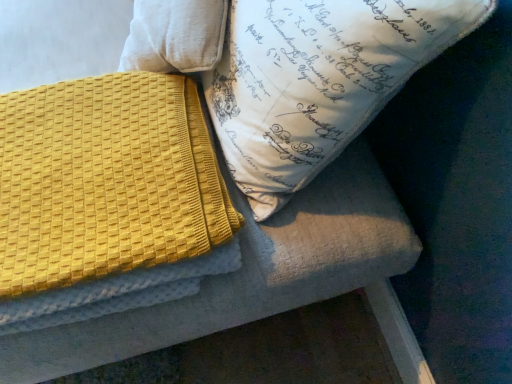
Question: Is white printed pillow at upper center facing towards yellow textured blanket at upper left?

Choices:
 (A) no
 (B) yes

Answer: (B)

Question: Considering the relative sizes of white printed pillow at upper center and yellow textured blanket at upper left in the image provided, is white printed pillow at upper center thinner than yellow textured blanket at upper left?

Choices:
 (A) no
 (B) yes

Answer: (B)

Question: Is white printed pillow at upper center taller than yellow textured blanket at upper left?

Choices:
 (A) no
 (B) yes

Answer: (B)

Question: Is white printed pillow at upper center smaller than yellow textured blanket at upper left?

Choices:
 (A) no
 (B) yes

Answer: (A)

Question: From a real-world perspective, does white printed pillow at upper center stand above yellow textured blanket at upper left?

Choices:
 (A) yes
 (B) no

Answer: (A)

Question: From the image's perspective, would you say white printed pillow at upper center is positioned over yellow textured blanket at upper left?

Choices:
 (A) no
 (B) yes

Answer: (B)

Question: From a real-world perspective, is yellow textured blanket at upper left positioned over white printed pillow at upper center based on gravity?

Choices:
 (A) no
 (B) yes

Answer: (A)

Question: Considering the relative sizes of yellow textured blanket at upper left and white printed pillow at upper center in the image provided, is yellow textured blanket at upper left wider than white printed pillow at upper center?

Choices:
 (A) yes
 (B) no

Answer: (A)

Question: Is yellow textured blanket at upper left positioned before white printed pillow at upper center?

Choices:
 (A) yes
 (B) no

Answer: (B)

Question: Is yellow textured blanket at upper left shorter than white printed pillow at upper center?

Choices:
 (A) no
 (B) yes

Answer: (B)

Question: Is yellow textured blanket at upper left with white printed pillow at upper center?

Choices:
 (A) no
 (B) yes

Answer: (A)

Question: Could you tell me if yellow textured blanket at upper left is turned towards white printed pillow at upper center?

Choices:
 (A) no
 (B) yes

Answer: (A)

Question: From a real-world perspective, is white printed pillow at upper center above or below yellow textured blanket at upper left?

Choices:
 (A) below
 (B) above

Answer: (B)